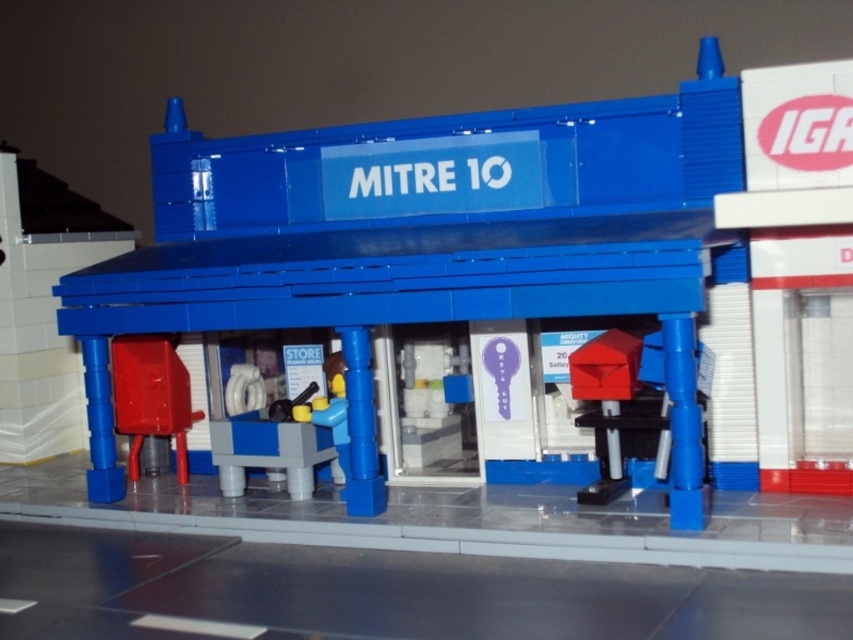
In the scene shown: Who is positioned more to the right, matte blue building at center or matte red toolbox at center?

Positioned to the right is matte blue building at center.

Does matte blue building at center have a lesser width compared to matte red toolbox at center?

Incorrect, matte blue building at center's width is not less than matte red toolbox at center's.

Is point (706, 252) positioned after point (144, 397)?

No, it is not.

Identify the location of matte blue building at center. The width and height of the screenshot is (853, 640). (430, 227).

Does matte red toolbox at center appear on the left side of smooth plastic water dispenser at center?

Yes, matte red toolbox at center is to the left of smooth plastic water dispenser at center.

Does matte red toolbox at center have a lesser width compared to smooth plastic water dispenser at center?

Yes.

Between point (131, 340) and point (274, 448), which one is positioned behind?

Point (131, 340)

The width and height of the screenshot is (853, 640). I want to click on matte red toolbox at center, so click(151, 396).

The height and width of the screenshot is (640, 853). What do you see at coordinates (44, 307) in the screenshot? I see `matte blue toolbox at lower left` at bounding box center [44, 307].

Who is positioned more to the right, matte blue toolbox at lower left or matte red toolbox at center?

matte red toolbox at center is more to the right.

At what (x,y) coordinates should I click in order to perform the action: click on matte blue toolbox at lower left. Please return your answer as a coordinate pair (x, y). This screenshot has height=640, width=853. Looking at the image, I should click on pyautogui.click(x=44, y=307).